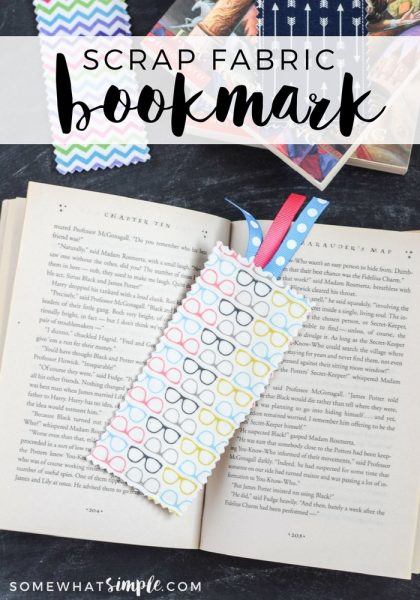
At what (x,y) coordinates should I click in order to perform the action: click on table. Please return your answer as a coordinate pair (x, y). The height and width of the screenshot is (600, 420). Looking at the image, I should click on (182, 170).